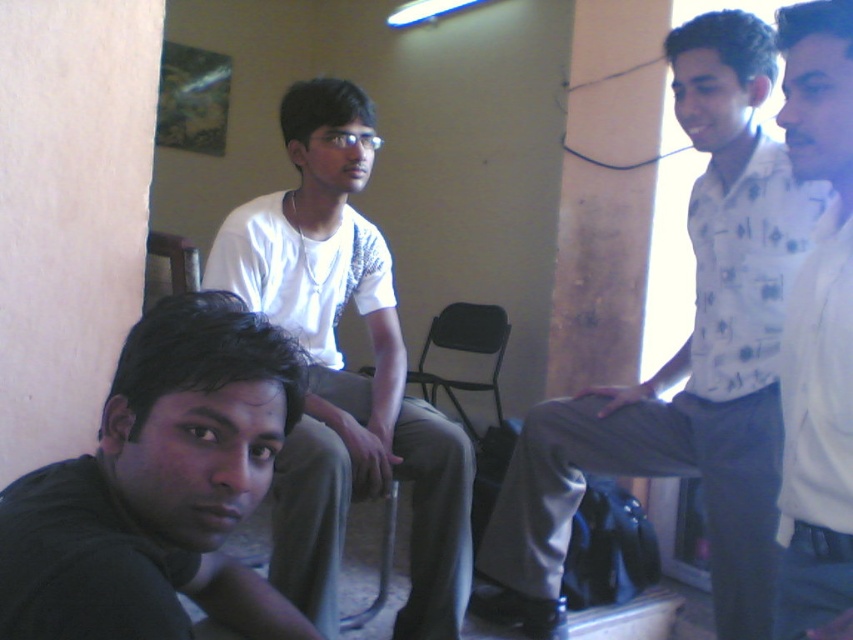
Question: Estimate the real-world distances between objects in this image. Which object is closer to the black matte shirt at lower left?

Choices:
 (A) white matte shirt at center
 (B) white printed shirt at upper right

Answer: (A)

Question: Where is white matte shirt at center located in relation to black metal chair at center in the image?

Choices:
 (A) right
 (B) left

Answer: (B)

Question: Is black matte shirt at lower left bigger than white matte shirt at upper right?

Choices:
 (A) no
 (B) yes

Answer: (B)

Question: Which object appears closest to the camera in this image?

Choices:
 (A) black matte shirt at lower left
 (B) black metal chair at center
 (C) white matte shirt at center
 (D) white matte shirt at upper right

Answer: (A)

Question: Which point is farther to the camera?

Choices:
 (A) black metal chair at center
 (B) white printed shirt at upper right

Answer: (A)

Question: Is white printed shirt at upper right closer to the viewer compared to black metal chair at center?

Choices:
 (A) no
 (B) yes

Answer: (B)